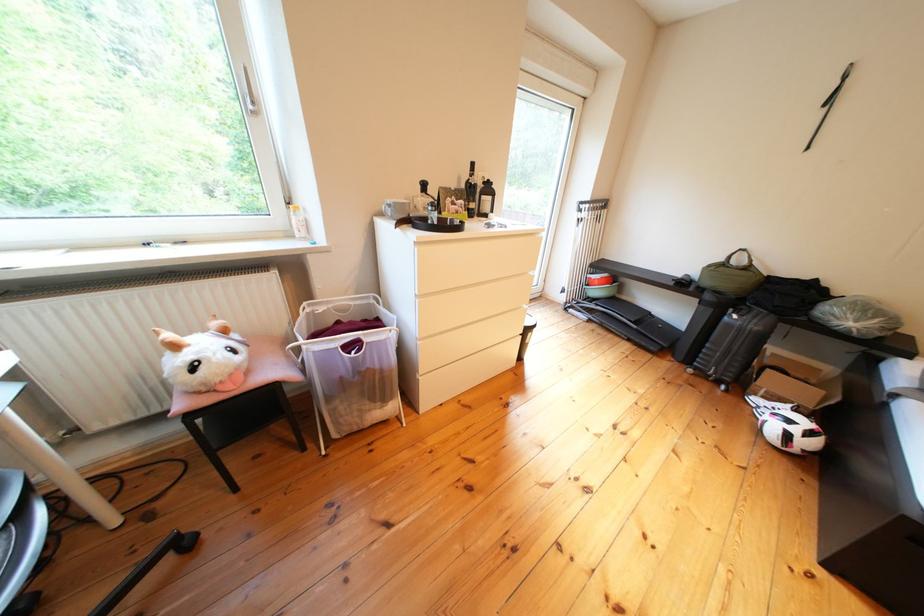
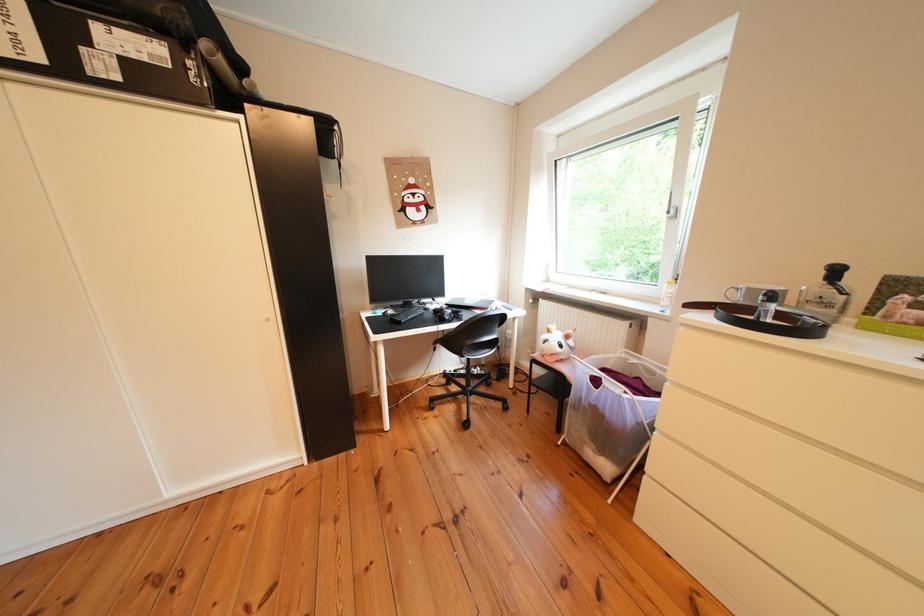
The point at (463, 216) is marked in the first image. Where is the corresponding point in the second image?

(901, 322)